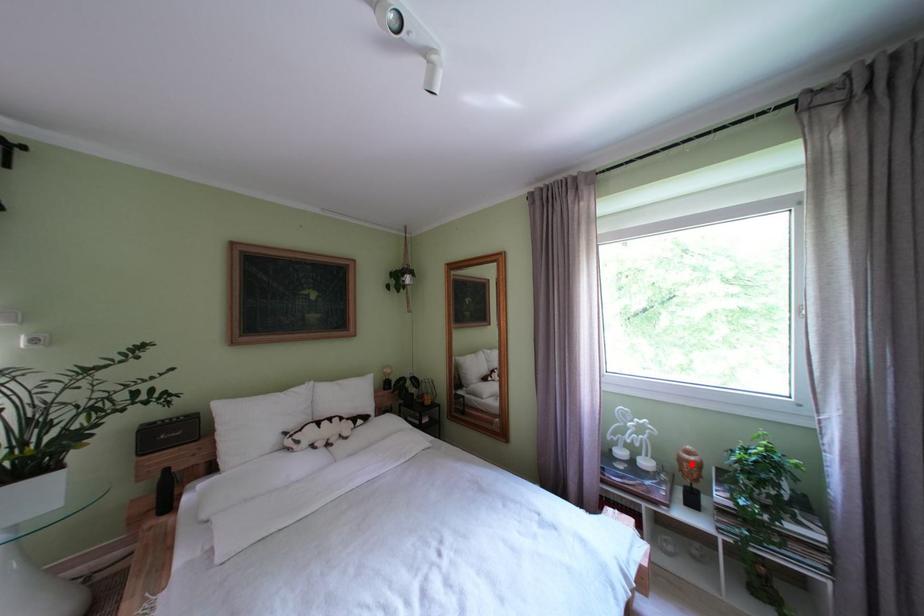
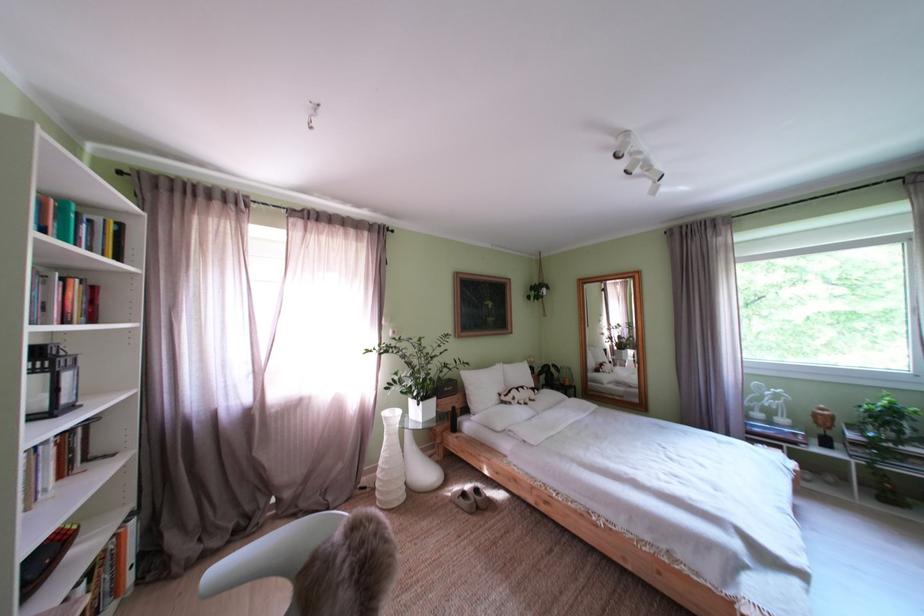
In the second image, find the point that corresponds to the highlighted location in the first image.

(825, 419)